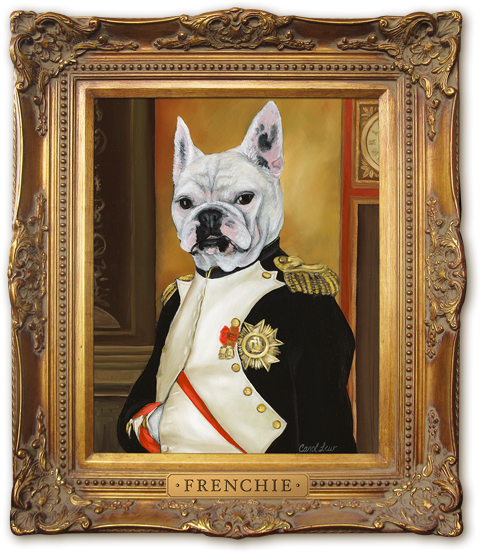
The width and height of the screenshot is (481, 553). I want to click on clock, so tap(371, 144).